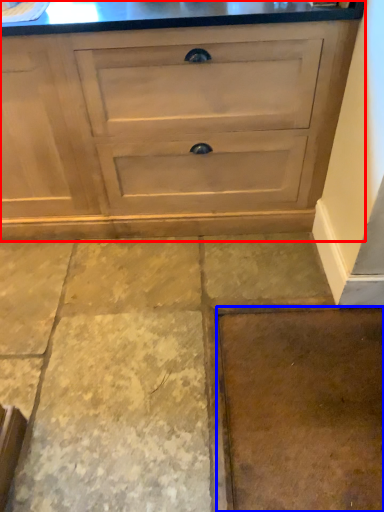
Question: Which object appears farthest to the camera in this image, chest of drawers (highlighted by a red box) or concrete (highlighted by a blue box)?

Choices:
 (A) chest of drawers
 (B) concrete

Answer: (A)